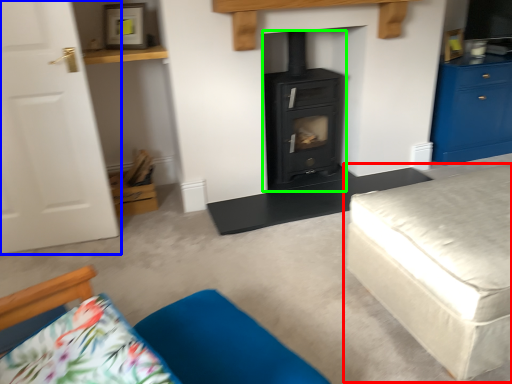
Question: Based on their relative distances, which object is farther from studio couch (highlighted by a red box)? Choose from door (highlighted by a blue box) and wood burning stove (highlighted by a green box).

Choices:
 (A) door
 (B) wood burning stove

Answer: (A)